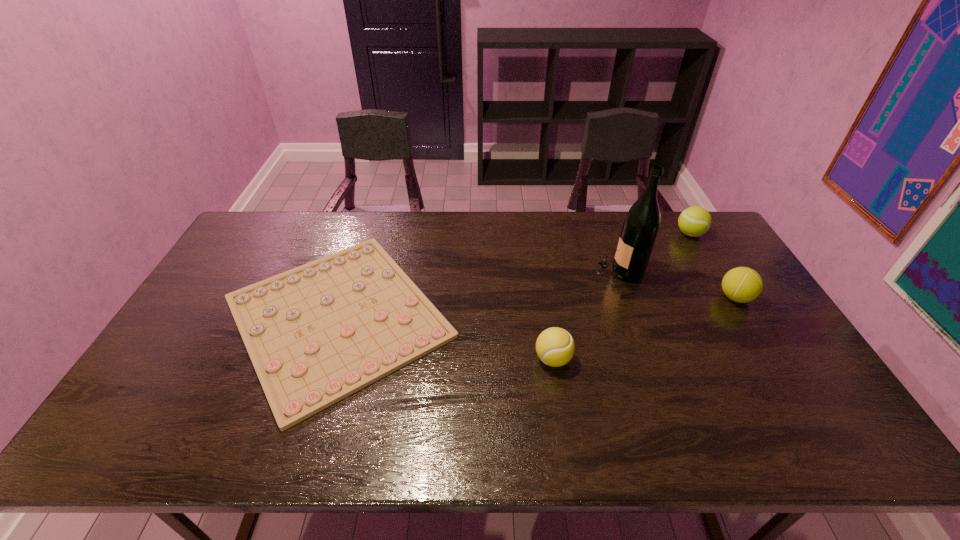
At what (x,y) coordinates should I click in order to perform the action: click on the tallest object. Please return your answer as a coordinate pair (x, y). The height and width of the screenshot is (540, 960). Looking at the image, I should click on (641, 225).

Where is `the third object from left to right`? Image resolution: width=960 pixels, height=540 pixels. the third object from left to right is located at coordinates (641, 225).

You are a GUI agent. You are given a task and a screenshot of the screen. Output one action in this format:
    pyautogui.click(x=<x>, y=<y>)
    Task: Click on the farthest tennis ball
    This screenshot has width=960, height=540.
    Given the screenshot: What is the action you would take?
    pyautogui.click(x=694, y=221)

Where is `the second farthest tennis ball`? the second farthest tennis ball is located at coordinates (741, 284).

Locate an element on the screen. the leftmost tennis ball is located at coordinates 555,347.

Find the location of a particular element. This screenshot has width=960, height=540. the nearest tennis ball is located at coordinates [555, 347].

Where is `gameboard`? This screenshot has height=540, width=960. gameboard is located at coordinates (316, 334).

What are the coordinates of `the shortest object` in the screenshot? It's located at coord(316,334).

Locate an element on the screen. vacant space located on the left of the wine bottle is located at coordinates (579, 269).

In order to click on free spot located 0.320m on the left of the farthest tennis ball in this screenshot , I will do `click(587, 234)`.